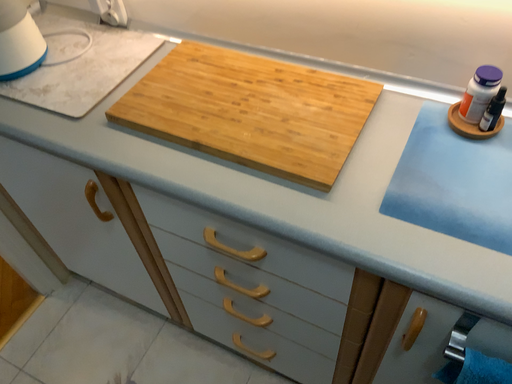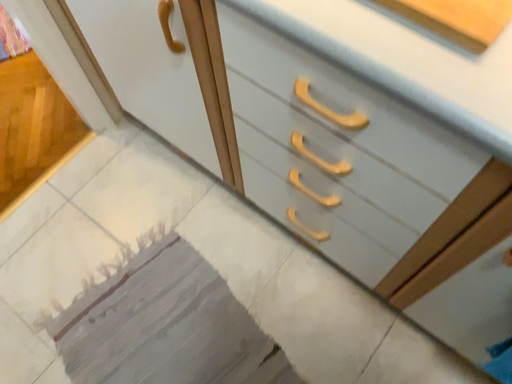
Question: Which way did the camera rotate in the video?

Choices:
 (A) rotated right
 (B) rotated left

Answer: (B)